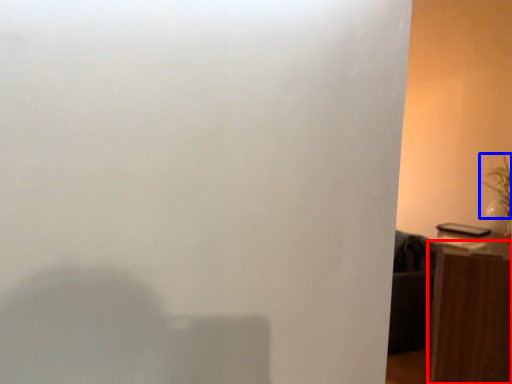
Question: Which point is further to the camera, furniture (highlighted by a red box) or plant (highlighted by a blue box)?

Choices:
 (A) furniture
 (B) plant

Answer: (B)